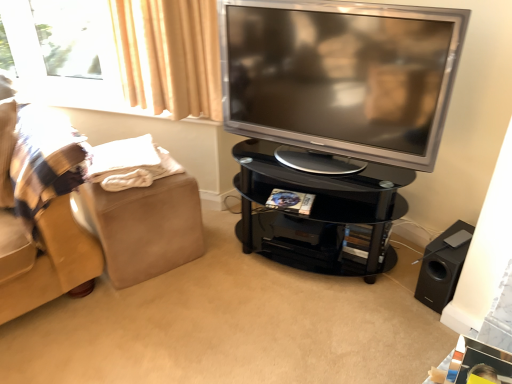
I want to click on vacant area that lies between beige fabric footrest at left and black glass tv stand at center, so click(232, 267).